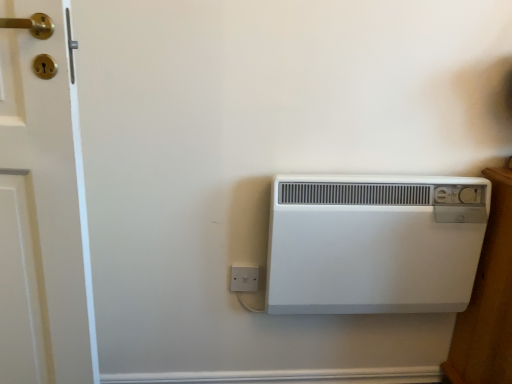
Question: Does white plastic electric outlet at lower center have a greater height compared to white plastic heater at center?

Choices:
 (A) no
 (B) yes

Answer: (A)

Question: Considering the relative positions of white plastic electric outlet at lower center and white plastic heater at center in the image provided, is white plastic electric outlet at lower center to the right of white plastic heater at center from the viewer's perspective?

Choices:
 (A) yes
 (B) no

Answer: (B)

Question: Can you confirm if white plastic electric outlet at lower center is shorter than white plastic heater at center?

Choices:
 (A) yes
 (B) no

Answer: (A)

Question: From a real-world perspective, is white plastic electric outlet at lower center located beneath white plastic heater at center?

Choices:
 (A) no
 (B) yes

Answer: (B)

Question: Can you confirm if white plastic electric outlet at lower center is bigger than white plastic heater at center?

Choices:
 (A) yes
 (B) no

Answer: (B)

Question: Is white plastic electric outlet at lower center with white plastic heater at center?

Choices:
 (A) yes
 (B) no

Answer: (B)

Question: Does white plastic heater at center have a greater height compared to white plastic electric outlet at lower center?

Choices:
 (A) yes
 (B) no

Answer: (A)

Question: Considering the relative sizes of white plastic heater at center and white plastic electric outlet at lower center in the image provided, is white plastic heater at center thinner than white plastic electric outlet at lower center?

Choices:
 (A) no
 (B) yes

Answer: (A)

Question: From the image's perspective, does white plastic heater at center appear lower than white plastic electric outlet at lower center?

Choices:
 (A) yes
 (B) no

Answer: (B)

Question: From a real-world perspective, is white plastic heater at center located beneath white plastic electric outlet at lower center?

Choices:
 (A) no
 (B) yes

Answer: (A)

Question: Is white plastic heater at center to the right of white plastic electric outlet at lower center from the viewer's perspective?

Choices:
 (A) no
 (B) yes

Answer: (B)

Question: Is white plastic heater at center looking in the opposite direction of white plastic electric outlet at lower center?

Choices:
 (A) no
 (B) yes

Answer: (A)

Question: Considering the positions of white plastic electric outlet at lower center and white plastic heater at center in the image, is white plastic electric outlet at lower center wider or thinner than white plastic heater at center?

Choices:
 (A) wide
 (B) thin

Answer: (B)